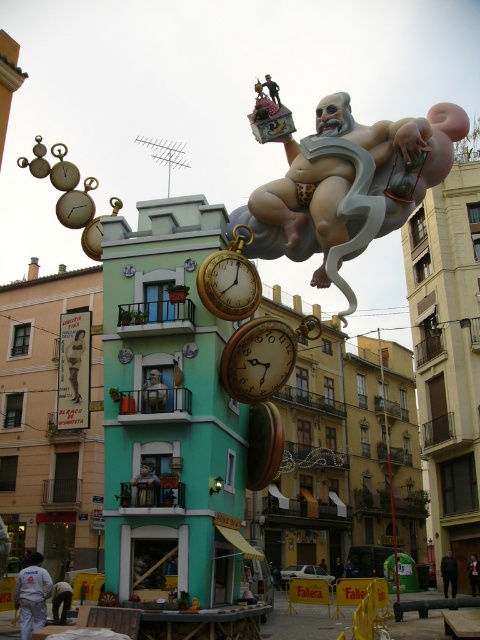
Looking at this image, how much distance is there between matte gold statue at center and gold metallic clock at center?

matte gold statue at center is 8.97 meters from gold metallic clock at center.

Between matte gold statue at center and gold metallic clock at center, which one is positioned lower?

gold metallic clock at center

Does point (304, 234) lie in front of point (291, 332)?

No, (304, 234) is further to viewer.

You are a GUI agent. You are given a task and a screenshot of the screen. Output one action in this format:
    pyautogui.click(x=<x>, y=<y>)
    Task: Click on the matte gold statue at center
    The image size is (480, 640).
    Given the screenshot: What is the action you would take?
    pyautogui.click(x=348, y=186)

Does matte gold statue at center appear under gold metallic pocket watch at center?

No, matte gold statue at center is not below gold metallic pocket watch at center.

In the scene shown: Between matte gold statue at center and gold metallic pocket watch at center, which one is positioned higher?

matte gold statue at center is higher up.

Is point (355, 228) positioned before point (204, 264)?

No.

Locate an element on the screen. matte gold statue at center is located at coordinates (348, 186).

Who is lower down, gold metallic clock at center or gold metallic pocket watch at center?

gold metallic clock at center is lower down.

Is gold metallic clock at center closer to the viewer compared to gold metallic pocket watch at center?

No, gold metallic clock at center is further to the viewer.

In order to click on gold metallic clock at center in this screenshot , I will do `click(257, 358)`.